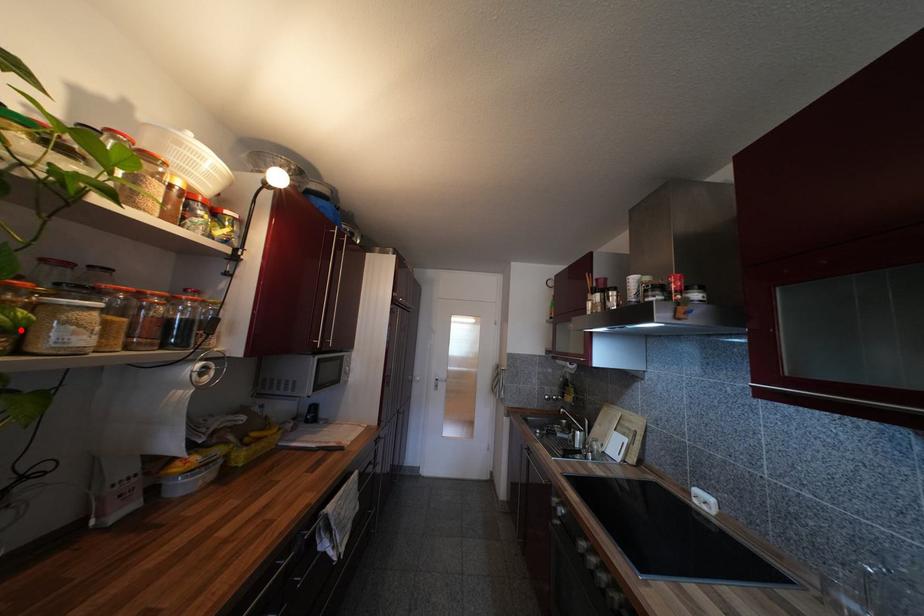
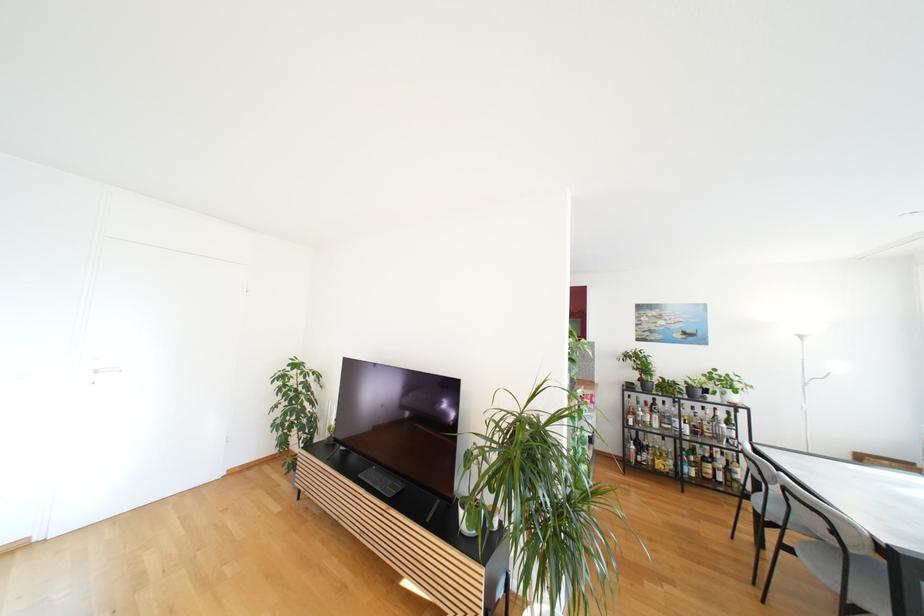
Question: I am providing you with two images of the same scene from different viewpoints. A red point is marked on the first image. Can you still see the location of the red point in image 2?

Choices:
 (A) Yes
 (B) No

Answer: (B)